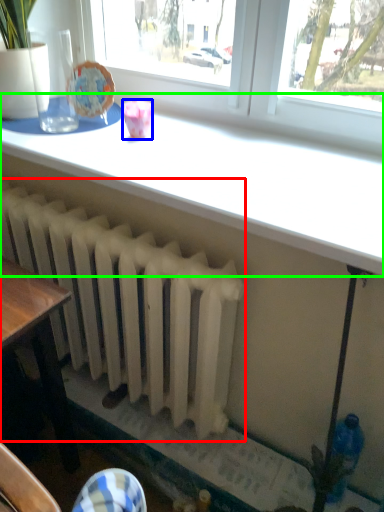
Question: Estimate the real-world distances between objects in this image. Which object is farther from radiator (highlighted by a red box), tableware (highlighted by a blue box) or table (highlighted by a green box)?

Choices:
 (A) tableware
 (B) table

Answer: (A)